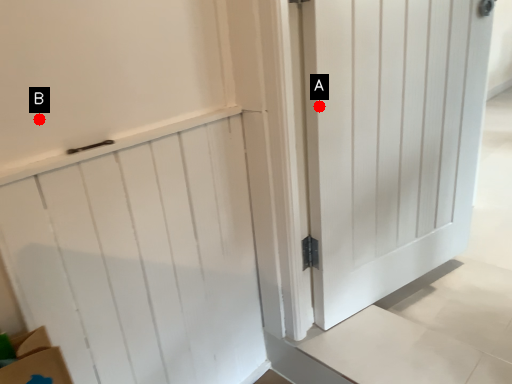
Question: Two points are circled on the image, labeled by A and B beside each circle. Which point appears farthest from the camera in this image?

Choices:
 (A) A is further
 (B) B is further

Answer: (A)